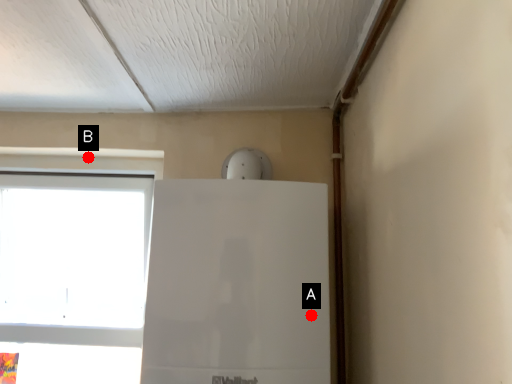
Question: Two points are circled on the image, labeled by A and B beside each circle. Which point is farther from the camera taking this photo?

Choices:
 (A) A is further
 (B) B is further

Answer: (B)